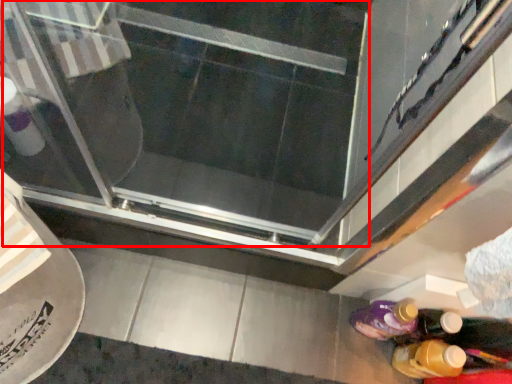
Question: Observing the image, what is the correct spatial positioning of screen door (annotated by the red box) in reference to bottle?

Choices:
 (A) left
 (B) right

Answer: (A)